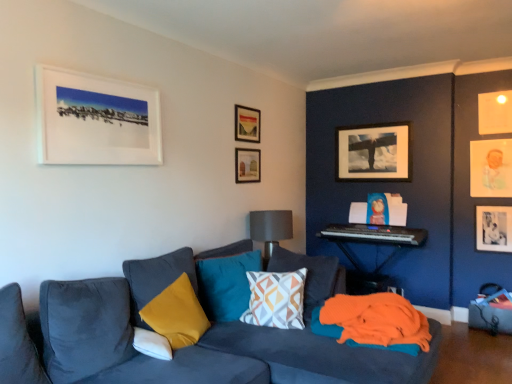
Question: Can you confirm if matte black picture frame at upper right, which is the fourth picture frame in left-to-right order, is shorter than velvet yellow pillow at lower left, the second pillow from the front?

Choices:
 (A) yes
 (B) no

Answer: (B)

Question: From a real-world perspective, is matte black picture frame at upper right, which is the fourth picture frame in left-to-right order, under velvet yellow pillow at lower left, which is the 3th pillow in back-to-front order?

Choices:
 (A) no
 (B) yes

Answer: (A)

Question: Does matte black picture frame at upper right, placed as the seventh picture frame when sorted from front to back, appear on the left side of velvet yellow pillow at lower left, the second pillow from the front?

Choices:
 (A) yes
 (B) no

Answer: (B)

Question: Is there a large distance between matte black picture frame at upper right, placed as the seventh picture frame when sorted from front to back, and velvet yellow pillow at lower left, the second pillow from the front?

Choices:
 (A) yes
 (B) no

Answer: (A)

Question: Is matte black picture frame at upper right, marked as the 4th picture frame in a right-to-left arrangement, facing towards velvet yellow pillow at lower left, which is the 3th pillow in back-to-front order?

Choices:
 (A) no
 (B) yes

Answer: (B)

Question: Is matte black picture frame at upper right, placed as the seventh picture frame when sorted from front to back, thinner than velvet yellow pillow at lower left, which is the 3th pillow in back-to-front order?

Choices:
 (A) yes
 (B) no

Answer: (A)

Question: Is geometric-patterned fabric pillow at center, which is the 2th pillow in back-to-front order, facing away from yellow fabric pillow at center, acting as the 4th pillow starting from the front?

Choices:
 (A) yes
 (B) no

Answer: (B)

Question: Considering the relative sizes of geometric-patterned fabric pillow at center, which is the 2th pillow in back-to-front order, and yellow fabric pillow at center, acting as the 4th pillow starting from the front, in the image provided, is geometric-patterned fabric pillow at center, which is the 2th pillow in back-to-front order, shorter than yellow fabric pillow at center, acting as the 4th pillow starting from the front,?

Choices:
 (A) no
 (B) yes

Answer: (B)

Question: Is geometric-patterned fabric pillow at center, which is the 2th pillow in back-to-front order, surrounding yellow fabric pillow at center, acting as the 4th pillow starting from the front?

Choices:
 (A) yes
 (B) no

Answer: (B)

Question: Is geometric-patterned fabric pillow at center, the third pillow from the front, not near yellow fabric pillow at center, the 1th pillow when ordered from back to front?

Choices:
 (A) no
 (B) yes

Answer: (A)

Question: Is geometric-patterned fabric pillow at center, the third pillow from the front, in contact with yellow fabric pillow at center, the 1th pillow when ordered from back to front?

Choices:
 (A) no
 (B) yes

Answer: (A)

Question: Considering the relative sizes of geometric-patterned fabric pillow at center, the third pillow from the front, and yellow fabric pillow at center, the 1th pillow when ordered from back to front, in the image provided, is geometric-patterned fabric pillow at center, the third pillow from the front, smaller than yellow fabric pillow at center, the 1th pillow when ordered from back to front,?

Choices:
 (A) no
 (B) yes

Answer: (A)

Question: From the image's perspective, is gray fabric lampshade at center on top of orange fabric at lower right?

Choices:
 (A) yes
 (B) no

Answer: (A)